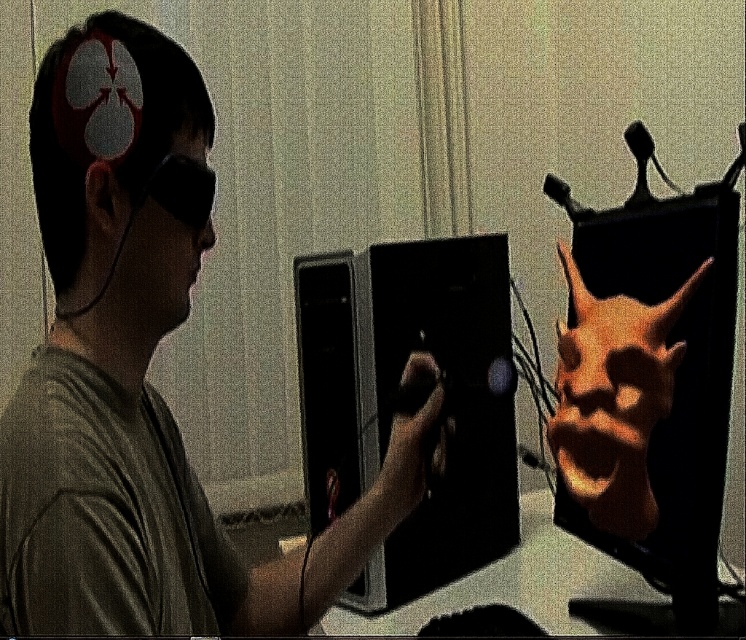
You are setting up a VR setup in a room with a matte black laptop at left. Where should you place the VR headset and controller to avoid blocking the laptop?

The VR headset and controller should be placed away from the matte black laptop at left to avoid blocking it. Since the laptop is located at point (142, 376), positioning the headset and controller in a different area of the room would ensure the laptop remains accessible and unobstructed.

You are setting up a desk for a VR setup. You have a matte black laptop at left and a black glossy monitor at center. Which device is taller?

The matte black laptop at left is taller than the black glossy monitor at center.

You are in a room with a VR setup. You need to place a new VR headset on the table. The current VR headset is at point (142, 376). Where should you place the new one so it doesn

The new VR headset should be placed away from the existing one at point (142, 376) to avoid clutter and ensure easy access.